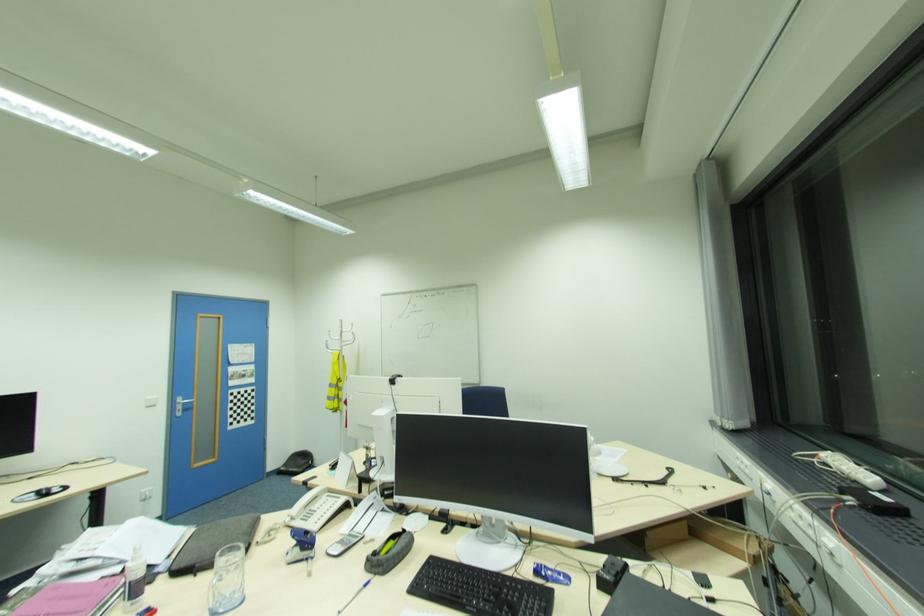
The width and height of the screenshot is (924, 616). Describe the element at coordinates (226, 580) in the screenshot. I see `a clear drinking glass` at that location.